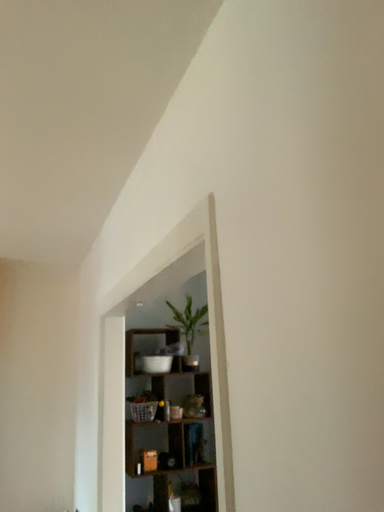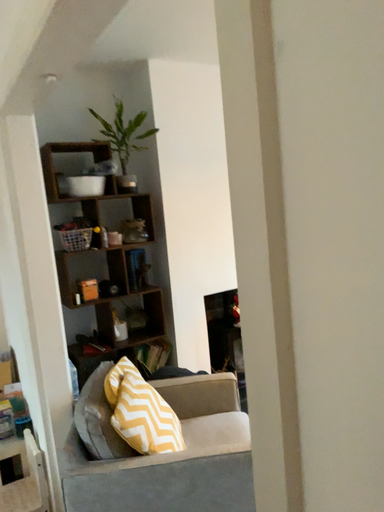
Question: How did the camera likely rotate when shooting the video?

Choices:
 (A) rotated right
 (B) rotated left

Answer: (A)